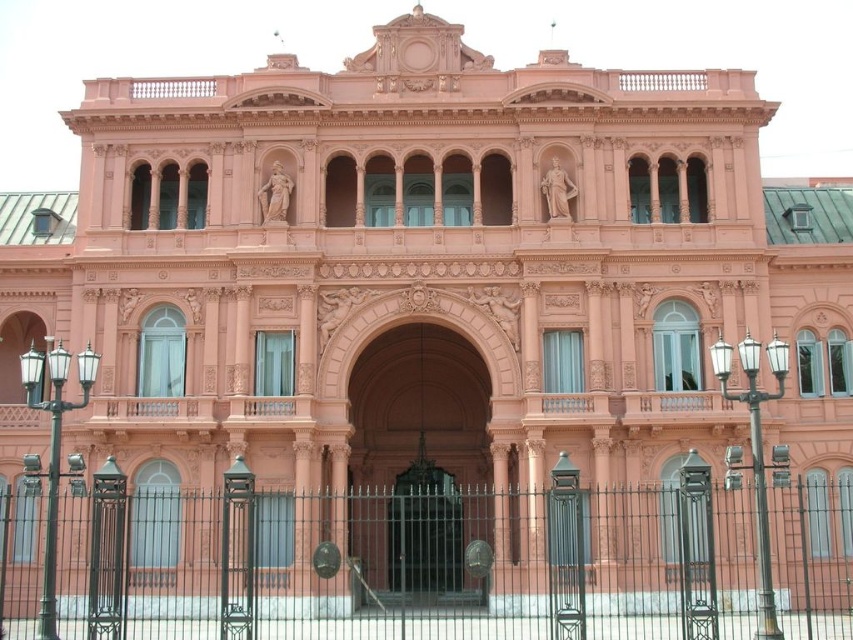
You are a delivery person trying to enter the building through the polished bronze door at center. There is a black wrought iron fence at center blocking your path. Can you walk through the fence to reach the door?

The black wrought iron fence at center is taller than the polished bronze door at center. Since the fence is taller, it likely blocks access to the door, so you cannot walk through the fence to reach the polished bronze door at center.

Consider the image. You are standing in front of the grand pink building and want to enter through the polished bronze door at center. Is the black wrought iron fence at center blocking your path to the door?

The black wrought iron fence at center is closer to the viewer than the polished bronze door at center, so the fence is blocking your path to the door.